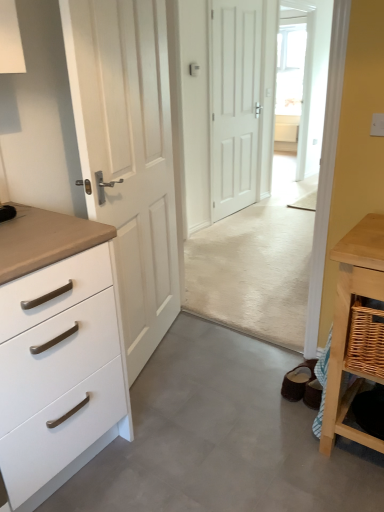
Question: Which is correct: woven wood table at right is inside transparent glass door at upper center, or outside of it?

Choices:
 (A) inside
 (B) outside

Answer: (B)

Question: From a real-world perspective, is woven wood table at right positioned above or below transparent glass door at upper center?

Choices:
 (A) above
 (B) below

Answer: (B)

Question: Which of these objects is positioned farthest from the woven wood table at right?

Choices:
 (A) transparent glass door at upper center
 (B) woven wood basket at lower right
 (C) white matte chest of drawers at left
 (D) white matte door at center, marked as the 2th door in a left-to-right arrangement
 (E) white wood door at left, which ranks as the first door in front-to-back order

Answer: (A)

Question: Based on their relative distances, which object is farther from the white matte chest of drawers at left?

Choices:
 (A) woven wood basket at lower right
 (B) transparent glass door at upper center
 (C) white wood door at left, positioned as the second door in back-to-front order
 (D) woven wood table at right
 (E) white matte door at center, the first door positioned from the back

Answer: (B)